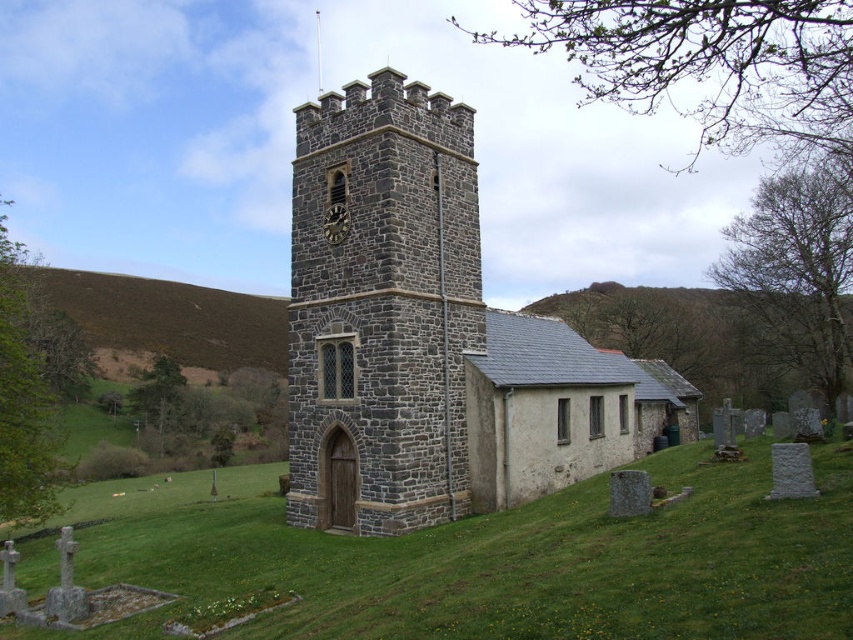
Question: Does gray stone church at center appear on the right side of green grass at lower center?

Choices:
 (A) no
 (B) yes

Answer: (B)

Question: Is gray stone church at center positioned in front of dark gray stone tower at center?

Choices:
 (A) no
 (B) yes

Answer: (A)

Question: Which of the following is the closest to the observer?

Choices:
 (A) (697, 465)
 (B) (357, 320)
 (C) (316, 260)

Answer: (B)

Question: Which of the following is the closest to the observer?

Choices:
 (A) green grass at lower center
 (B) gray stone church at center
 (C) dark gray stone tower at center

Answer: (A)

Question: Can you confirm if green grass at lower center is thinner than dark gray stone tower at center?

Choices:
 (A) no
 (B) yes

Answer: (A)

Question: Considering the real-world distances, which object is closest to the green grass at lower center?

Choices:
 (A) gray stone church at center
 (B) dark gray stone tower at center

Answer: (B)